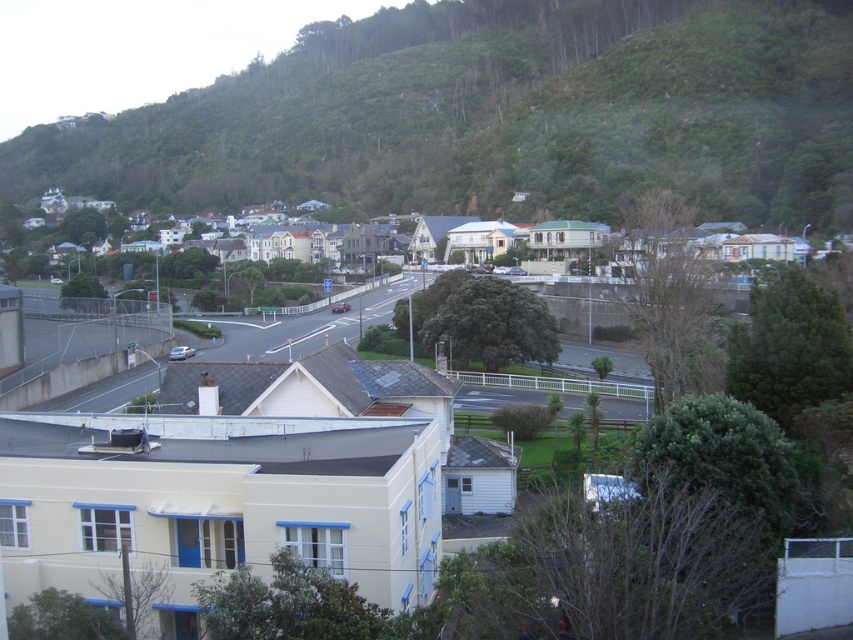
Is green leafy hillside at upper center taller than white painted houses at center?

Yes.

Who is more distant from viewer, (402,196) or (33,266)?

Point (33,266)

Does point (590, 196) lie in front of point (447, 224)?

Yes, it is in front of point (447, 224).

Find the location of a particular element. Image resolution: width=853 pixels, height=640 pixels. green leafy hillside at upper center is located at coordinates (498, 120).